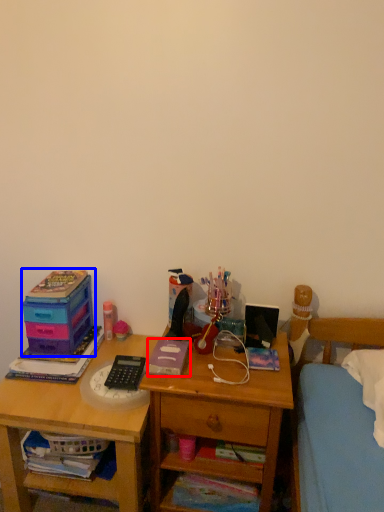
Question: Which object appears farthest to the camera in this image, book (highlighted by a red box) or storage box (highlighted by a blue box)?

Choices:
 (A) book
 (B) storage box

Answer: (B)